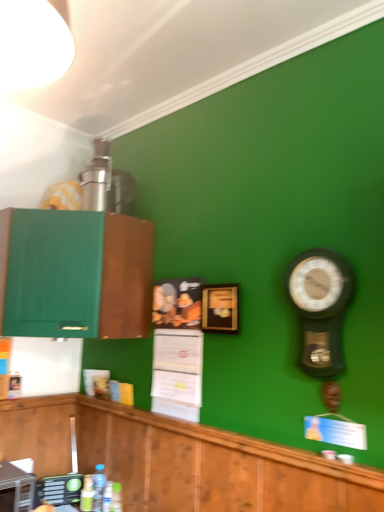
Question: Would you say metallic silver toaster at lower left, positioned as the first appliance in front-to-back order, is to the left or to the right of translucent plastic bottles at lower center, acting as the first bottle starting from the right, in the picture?

Choices:
 (A) left
 (B) right

Answer: (A)

Question: Based on their sizes in the image, would you say metallic silver toaster at lower left, positioned as the first appliance in front-to-back order, is bigger or smaller than translucent plastic bottles at lower center, acting as the first bottle starting from the right?

Choices:
 (A) small
 (B) big

Answer: (B)

Question: Which object is the farthest from the metallic pendulum clock at right?

Choices:
 (A) green matte cabinet at left, marked as the 1th cabinetry in a top-to-bottom arrangement
 (B) green matte bottle at lower left, placed as the 1th bottle when sorted from left to right
 (C) clear plastic bottle at lower center, which is the second bottle in left-to-right order
 (D) wooden picture frame at center
 (E) translucent plastic bottles at lower center, acting as the first bottle starting from the right

Answer: (B)

Question: Which object is the farthest from the wooden cabinetry at lower left, the 2th cabinetry positioned from the top?

Choices:
 (A) metallic pendulum clock at right
 (B) metallic silver toaster at lower left, positioned as the first appliance in front-to-back order
 (C) clear plastic bottle at lower center, positioned as the third bottle in right-to-left order
 (D) green plastic remote control at lower left, the 1th appliance from the back
 (E) green matte cabinet at left, which appears as the 2th cabinetry when ordered from the bottom

Answer: (E)